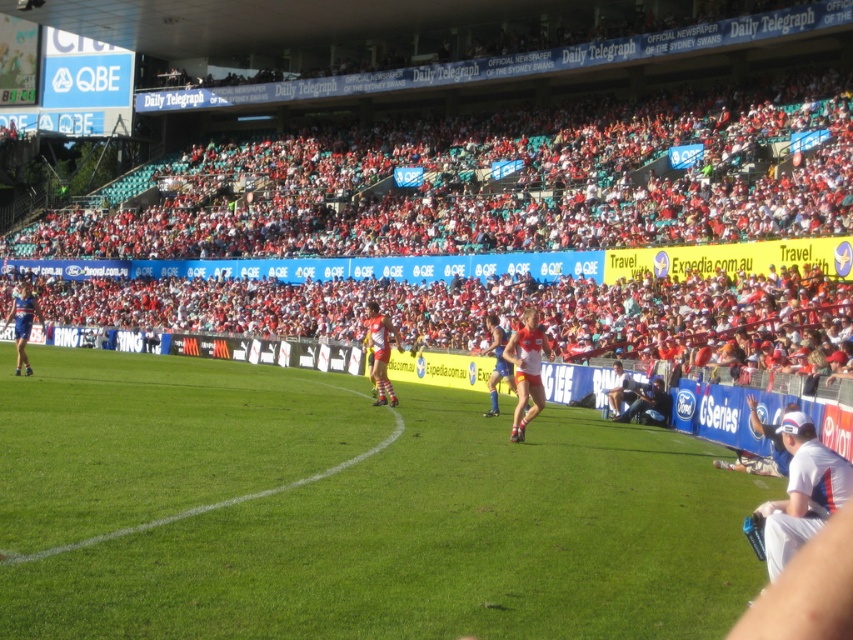
Question: Does white cotton cap at lower right have a lesser width compared to yellow jersey at center?

Choices:
 (A) yes
 (B) no

Answer: (A)

Question: Can you confirm if blue jersey at left is positioned below dark blue fabric camera at lower right?

Choices:
 (A) no
 (B) yes

Answer: (A)

Question: Which point is closer to the camera?

Choices:
 (A) orange jersey at center
 (B) red jersey at center

Answer: (B)

Question: Which object appears farthest from the camera in this image?

Choices:
 (A) orange jersey at center
 (B) blue jersey at left

Answer: (B)

Question: Among these objects, which one is farthest from the camera?

Choices:
 (A) white cotton cap at lower right
 (B) red jersey at center
 (C) blue jersey at left
 (D) orange jersey at center

Answer: (C)

Question: Is green grass at center to the left of dark blue fabric camera at lower right from the viewer's perspective?

Choices:
 (A) yes
 (B) no

Answer: (A)